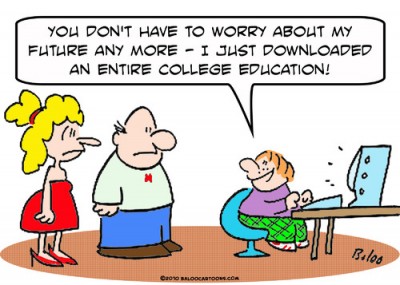
Locate an element on the screen. Image resolution: width=400 pixels, height=285 pixels. desk is located at coordinates (334, 226).